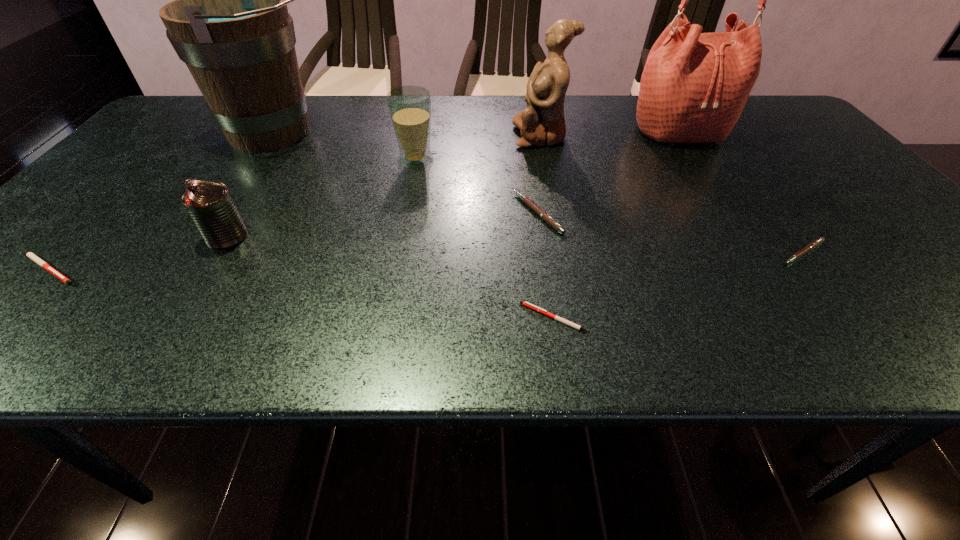
In order to click on free region located 0.180m at the nib of the fourth shortest object in this screenshot , I will do `click(435, 213)`.

This screenshot has height=540, width=960. Find the location of `free space located 0.200m at the nib of the fourth shortest object`. free space located 0.200m at the nib of the fourth shortest object is located at coordinates (425, 213).

Identify the location of vacant space situated 0.210m at the nib of the fourth shortest object. The width and height of the screenshot is (960, 540). (421, 213).

Where is `blank space located at the nib of the right pink pen`? The width and height of the screenshot is (960, 540). blank space located at the nib of the right pink pen is located at coordinates (857, 327).

The image size is (960, 540). In order to click on free space located 0.390m on the clicker of the right white pen in this screenshot , I will do `click(300, 318)`.

This screenshot has height=540, width=960. Identify the location of vacant space situated 0.330m on the clicker of the right white pen. (334, 318).

Find the location of a particular element. This screenshot has height=540, width=960. free space located on the clicker of the right white pen is located at coordinates (300, 318).

This screenshot has height=540, width=960. I want to click on handbag present at the far edge, so [694, 86].

Where is `wine bucket that is at the far edge`? Image resolution: width=960 pixels, height=540 pixels. wine bucket that is at the far edge is located at coordinates (229, 23).

This screenshot has width=960, height=540. I want to click on figurine present at the far edge, so click(542, 123).